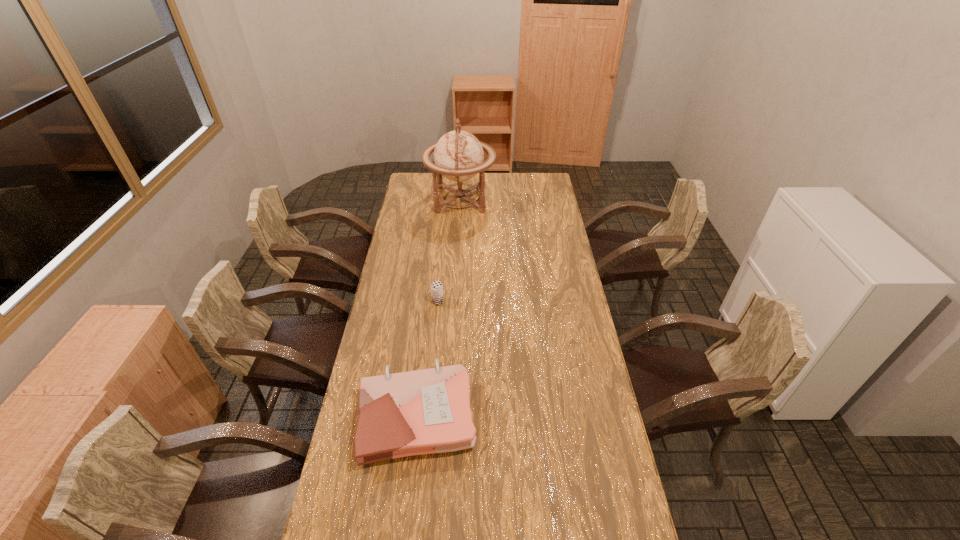
The image size is (960, 540). I want to click on globe, so click(458, 155).

At what (x,y) coordinates should I click in order to perform the action: click on the farthest object. Please return your answer as a coordinate pair (x, y). This screenshot has height=540, width=960. Looking at the image, I should click on (458, 155).

Identify the location of the second nearest object. coord(437,295).

Where is `the nearest object`? the nearest object is located at coordinates (427, 411).

I want to click on vacant area situated 0.100m at the front of the tallest object showing Africa, so click(514, 200).

You are a GUI agent. You are given a task and a screenshot of the screen. Output one action in this format:
    pyautogui.click(x=<x>, y=<y>)
    Task: Click on the vacant space positioned 0.140m on the back of the second nearest object
    This screenshot has height=540, width=960.
    Given the screenshot: What is the action you would take?
    pyautogui.click(x=441, y=275)

Identify the location of free location located on the right of the phonebook. Image resolution: width=960 pixels, height=540 pixels. (519, 415).

Identify the location of object that is at the far edge. The width and height of the screenshot is (960, 540). (458, 155).

Locate an element on the screen. The width and height of the screenshot is (960, 540). globe that is positioned at the left edge is located at coordinates (458, 155).

Where is `phonebook at the left edge`? phonebook at the left edge is located at coordinates (427, 411).